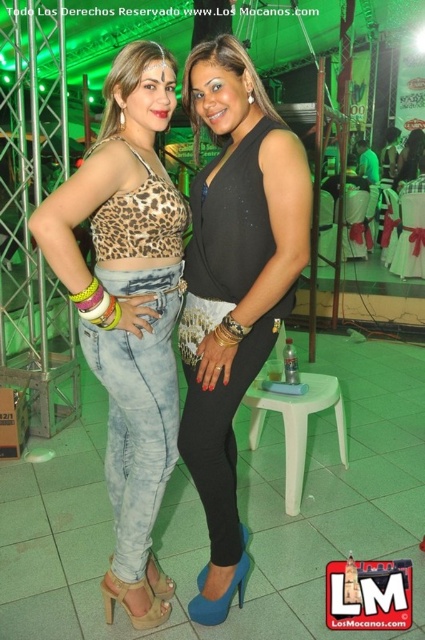
Does leopard print fabric top at center appear under black shiny dress at center?

Yes.

Find the location of a particular element. This screenshot has width=425, height=640. leopard print fabric top at center is located at coordinates (127, 308).

What are the coordinates of `leopard print fabric top at center` in the screenshot? It's located at (127, 308).

Is point (226, 179) more distant than point (317, 381)?

No, it is in front of (317, 381).

This screenshot has width=425, height=640. I want to click on black shiny dress at center, so click(x=234, y=285).

Is leopard print fabric top at center closer to camera compared to light green plastic stool at center?

Yes, leopard print fabric top at center is in front of light green plastic stool at center.

Is leopard print fabric top at center to the right of light green plastic stool at center from the viewer's perspective?

In fact, leopard print fabric top at center is to the left of light green plastic stool at center.

This screenshot has height=640, width=425. Identify the location of leopard print fabric top at center. (127, 308).